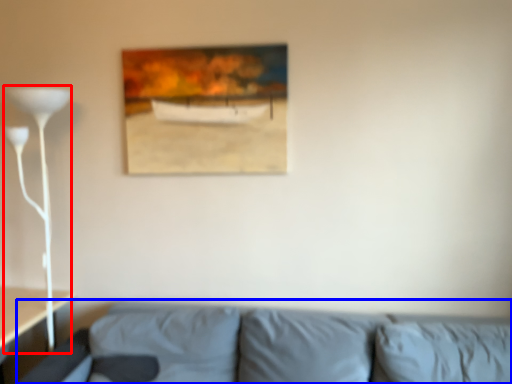
Question: Which point is further to the camera, table lamp (highlighted by a red box) or studio couch (highlighted by a blue box)?

Choices:
 (A) table lamp
 (B) studio couch

Answer: (A)